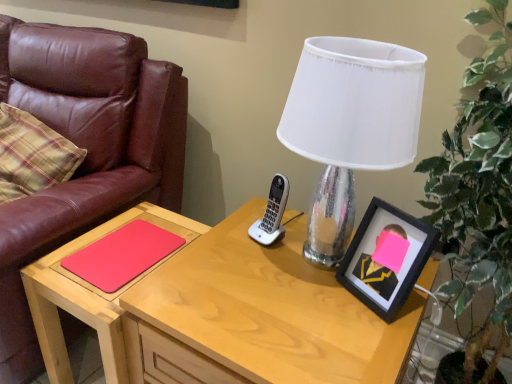
What do you see at coordinates (478, 200) in the screenshot? The width and height of the screenshot is (512, 384). I see `green leafy plant at right` at bounding box center [478, 200].

Describe the element at coordinates (386, 258) in the screenshot. The image size is (512, 384). I see `black matte picture frame at right` at that location.

Identify the location of matte wood desk at center. The height and width of the screenshot is (384, 512). click(258, 317).

Where is `clear glass lamp at center`? The image size is (512, 384). clear glass lamp at center is located at coordinates (350, 125).

This screenshot has height=384, width=512. In order to click on table directly beneath the black matte picture frame at right (from a real-world perspective) in this screenshot , I will do `click(90, 296)`.

Is matte wood table at lower left at the back of black matte picture frame at right?

That's not correct — black matte picture frame at right is not looking away from matte wood table at lower left.

Between black matte picture frame at right and matte wood table at lower left, which one is positioned behind?

matte wood table at lower left is behind.

Do you think black matte picture frame at right is within matte wood table at lower left, or outside of it?

black matte picture frame at right exists outside the volume of matte wood table at lower left.

Between point (351, 271) and point (133, 160), which one is positioned in front?

The point (351, 271) is closer to the camera.

Considering the sizes of black matte picture frame at right and matte brown leather chair at left in the image, is black matte picture frame at right wider or thinner than matte brown leather chair at left?

In the image, black matte picture frame at right appears to be more narrow than matte brown leather chair at left.

Is black matte picture frame at right taller or shorter than matte brown leather chair at left?

Considering their sizes, black matte picture frame at right has less height than matte brown leather chair at left.

How different are the orientations of black matte picture frame at right and matte brown leather chair at left in degrees?

The angle between the facing direction of black matte picture frame at right and the facing direction of matte brown leather chair at left is 25.8 degrees.

Is black matte picture frame at right taller than matte wood desk at center?

In fact, black matte picture frame at right may be shorter than matte wood desk at center.

Does black matte picture frame at right turn towards matte wood desk at center?

No, black matte picture frame at right is not turned towards matte wood desk at center.

Considering the relative positions of black matte picture frame at right and matte wood desk at center in the image provided, is black matte picture frame at right to the left or to the right of matte wood desk at center?

Clearly, black matte picture frame at right is on the right of matte wood desk at center in the image.

Between point (7, 288) and point (164, 245), which one is positioned in front?

The point (7, 288) is closer to the camera.

Could you tell me if matte brown leather chair at left is facing rubberized matte red notepad at lower left?

No.

Is matte brown leather chair at left smaller than rubberized matte red notepad at lower left?

No, matte brown leather chair at left is not smaller than rubberized matte red notepad at lower left.

Is matte brown leather chair at left not inside rubberized matte red notepad at lower left?

That's correct, matte brown leather chair at left is outside of rubberized matte red notepad at lower left.

Between clear glass lamp at center and black matte picture frame at right, which one appears on the left side from the viewer's perspective?

clear glass lamp at center.

From the picture: Which is closer, (382,46) or (394,278)?

Point (382,46) is closer to the camera than point (394,278).

In terms of height, does clear glass lamp at center look taller or shorter compared to black matte picture frame at right?

clear glass lamp at center is taller than black matte picture frame at right.

Is clear glass lamp at center smaller than black matte picture frame at right?

No, clear glass lamp at center is not smaller than black matte picture frame at right.

Based on their sizes in the image, would you say clear glass lamp at center is bigger or smaller than green leafy plant at right?

Clearly, clear glass lamp at center is smaller in size than green leafy plant at right.

Considering the positions of point (303, 140) and point (478, 64), is point (303, 140) closer or farther from the camera than point (478, 64)?

Clearly, point (303, 140) is closer to the camera than point (478, 64).

This screenshot has width=512, height=384. In order to click on houseplant below the clear glass lamp at center (from the image's perspective) in this screenshot , I will do `click(478, 200)`.

Who is taller, clear glass lamp at center or green leafy plant at right?

With more height is green leafy plant at right.

From a real-world perspective, relative to rubberized matte red notepad at lower left, is matte wood desk at center vertically above or below?

Clearly, from a real-world perspective, matte wood desk at center is below rubberized matte red notepad at lower left.

Does matte wood desk at center appear on the left side of rubberized matte red notepad at lower left?

No.

Can you see matte wood desk at center touching rubberized matte red notepad at lower left?

No, matte wood desk at center is not touching rubberized matte red notepad at lower left.

Is matte wood desk at center bigger than rubberized matte red notepad at lower left?

Indeed, matte wood desk at center has a larger size compared to rubberized matte red notepad at lower left.

Where is `picture frame that is on the right side of matte wood table at lower left`? The height and width of the screenshot is (384, 512). picture frame that is on the right side of matte wood table at lower left is located at coordinates (386, 258).

Where is `picture frame below the matte brown leather chair at left (from the image's perspective)`? Image resolution: width=512 pixels, height=384 pixels. picture frame below the matte brown leather chair at left (from the image's perspective) is located at coordinates (386, 258).

Estimate the real-world distances between objects in this image. Which object is further from black matte picture frame at right, matte brown leather chair at left or matte wood desk at center?

Among the two, matte brown leather chair at left is located further to black matte picture frame at right.

Based on their spatial positions, is rubberized matte red notepad at lower left or clear glass lamp at center further from black matte picture frame at right?

The object further to black matte picture frame at right is rubberized matte red notepad at lower left.

Considering their positions, is matte wood table at lower left positioned closer to matte brown leather chair at left than black matte picture frame at right?

matte wood table at lower left is closer to matte brown leather chair at left.

When comparing their distances from matte wood desk at center, does matte wood table at lower left or clear glass lamp at center seem further?

clear glass lamp at center is positioned further to the anchor matte wood desk at center.

When comparing their distances from matte brown leather chair at left, does rubberized matte red notepad at lower left or green leafy plant at right seem further?

Among the two, green leafy plant at right is located further to matte brown leather chair at left.

When comparing their distances from black matte picture frame at right, does matte wood table at lower left or matte wood desk at center seem closer?

matte wood desk at center is positioned closer to the anchor black matte picture frame at right.

Considering their positions, is matte wood desk at center positioned closer to green leafy plant at right than rubberized matte red notepad at lower left?

matte wood desk at center.

Looking at the image, which one is located closer to matte wood desk at center, black matte picture frame at right or matte wood table at lower left?

black matte picture frame at right is closer to matte wood desk at center.

This screenshot has width=512, height=384. I want to click on desk between matte wood table at lower left and black matte picture frame at right in the horizontal direction, so tap(258, 317).

This screenshot has height=384, width=512. I want to click on picture frame situated between matte brown leather chair at left and green leafy plant at right from left to right, so click(x=386, y=258).

The height and width of the screenshot is (384, 512). I want to click on desk between rubberized matte red notepad at lower left and black matte picture frame at right in the horizontal direction, so click(258, 317).

The height and width of the screenshot is (384, 512). Find the location of `lamp located between matte wood table at lower left and green leafy plant at right in the left-right direction`. lamp located between matte wood table at lower left and green leafy plant at right in the left-right direction is located at coordinates (350, 125).